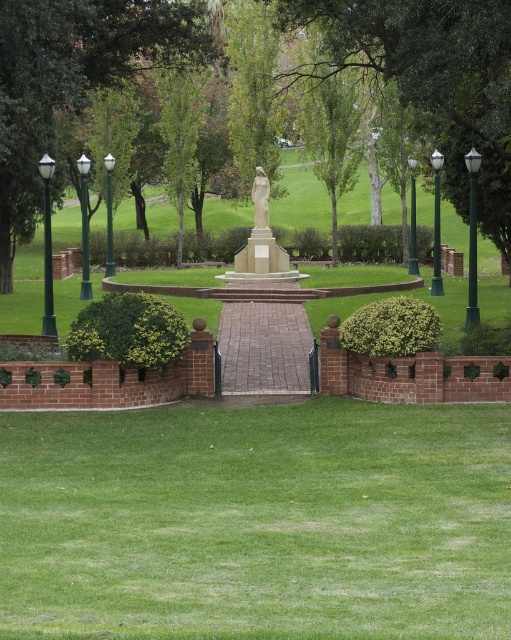
From the picture: Does green leafy hedge at center come behind green metallic lamp post at left?

Yes, green leafy hedge at center is behind green metallic lamp post at left.

Is point (345, 241) farther from camera compared to point (42, 323)?

That is True.

Where is `green leafy hedge at center`? green leafy hedge at center is located at coordinates (370, 243).

How much distance is there between green leafy tree at center and green glass lamp post at left?

green leafy tree at center and green glass lamp post at left are 10.11 meters apart.

Between point (505, 115) and point (108, 259), which one is positioned in front?

Point (505, 115) is more forward.

Is point (450, 138) closer to camera compared to point (111, 164)?

Yes, point (450, 138) is closer to viewer.

Locate an element on the screen. The image size is (511, 640). green leafy tree at center is located at coordinates (432, 81).

Between green leafy hedge at center and white marble statue at center, which one is positioned higher?

Positioned higher is white marble statue at center.

The height and width of the screenshot is (640, 511). Describe the element at coordinates (370, 243) in the screenshot. I see `green leafy hedge at center` at that location.

Where is `green leafy hedge at center`? This screenshot has height=640, width=511. green leafy hedge at center is located at coordinates (370, 243).